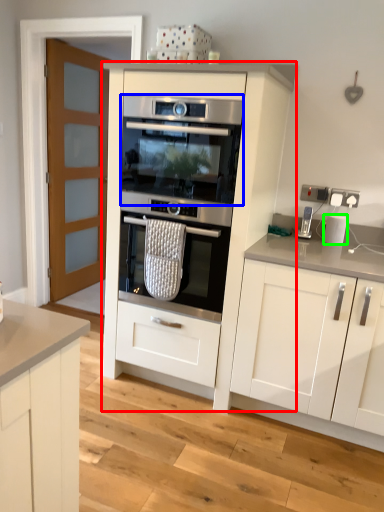
Question: Considering the real-world distances, which object is farthest from cabinetry (highlighted by a red box)? oven (highlighted by a blue box) or kitchen appliance (highlighted by a green box)?

Choices:
 (A) oven
 (B) kitchen appliance

Answer: (B)